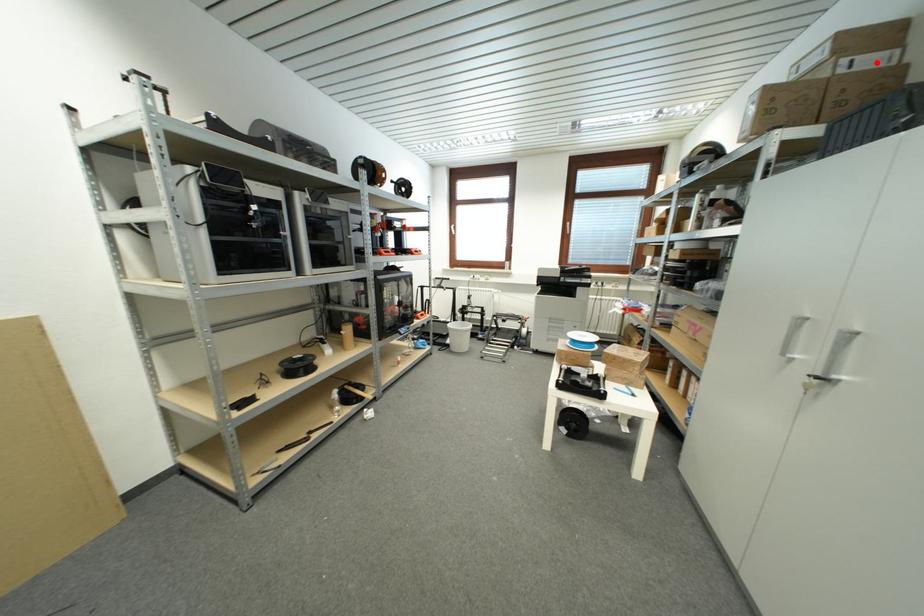
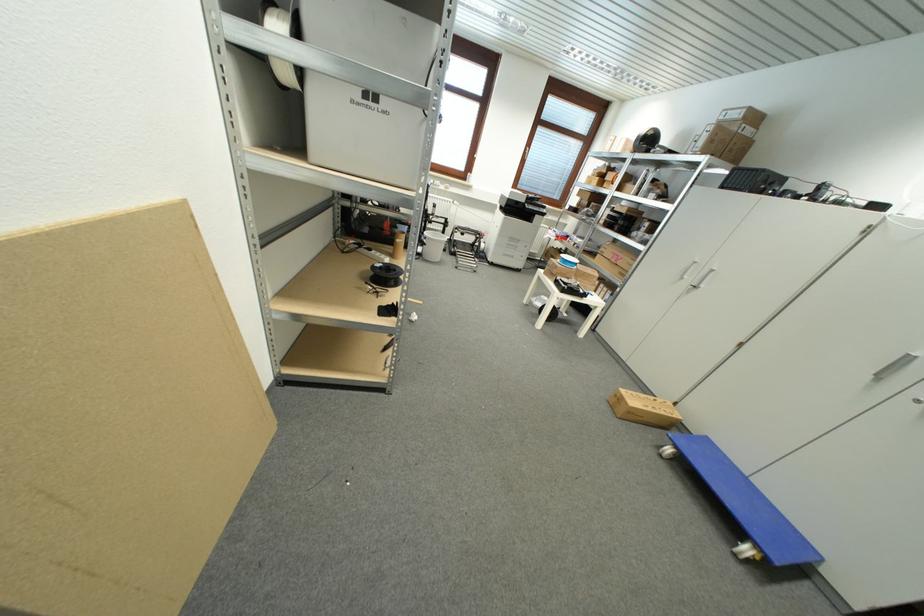
Find the pixel in the second image that matches the highlighted location in the first image.

(754, 134)